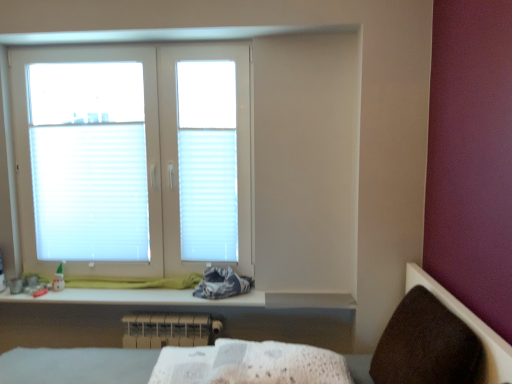
This screenshot has height=384, width=512. What are the coordinates of `white textured fabric at lower center` in the screenshot? It's located at (250, 364).

What do you see at coordinates (90, 192) in the screenshot?
I see `white pleated blind at upper left, acting as the 1th blind starting from the left` at bounding box center [90, 192].

Image resolution: width=512 pixels, height=384 pixels. I want to click on white glossy changing table at lower center, so click(x=194, y=300).

Describe the element at coordinates (426, 345) in the screenshot. I see `brown fabric armchair at lower right` at that location.

Where is `white textured fabric at lower center`? The height and width of the screenshot is (384, 512). white textured fabric at lower center is located at coordinates (250, 364).

From the image's perspective, between white plastic radiator at lower center and brown fabric armchair at lower right, who is located below?

white plastic radiator at lower center, from the image's perspective.

Based on their sizes in the image, would you say white plastic radiator at lower center is bigger or smaller than brown fabric armchair at lower right?

white plastic radiator at lower center is smaller than brown fabric armchair at lower right.

Is brown fabric armchair at lower right completely or partially inside white plastic radiator at lower center?

That's incorrect, brown fabric armchair at lower right is not inside white plastic radiator at lower center.

Based on the photo, from their relative heights in the image, would you say white pleated blind at upper left, which is the 2th blind in right-to-left order, is taller or shorter than white pleated blind at center, which appears as the second blind when viewed from the left?

Clearly, white pleated blind at upper left, which is the 2th blind in right-to-left order, is taller compared to white pleated blind at center, which appears as the second blind when viewed from the left.

How different are the orientations of white pleated blind at upper left, acting as the 1th blind starting from the left, and white pleated blind at center, which is the first blind from right to left, in degrees?

3.19e-05 degrees.

Considering the sizes of white pleated blind at upper left, which is the 2th blind in right-to-left order, and white pleated blind at center, which is the first blind from right to left, in the image, is white pleated blind at upper left, which is the 2th blind in right-to-left order, bigger or smaller than white pleated blind at center, which is the first blind from right to left,?

In the image, white pleated blind at upper left, which is the 2th blind in right-to-left order, appears to be larger than white pleated blind at center, which is the first blind from right to left.

Considering the relative positions of white pleated blind at upper left, which is the 2th blind in right-to-left order, and white pleated blind at center, which is the first blind from right to left, in the image provided, is white pleated blind at upper left, which is the 2th blind in right-to-left order, behind white pleated blind at center, which is the first blind from right to left,?

Yes, the depth of white pleated blind at upper left, which is the 2th blind in right-to-left order, is greater than that of white pleated blind at center, which is the first blind from right to left.

Considering the relative positions of brown fabric armchair at lower right and white pleated blind at center, which appears as the second blind when viewed from the left, in the image provided, is brown fabric armchair at lower right to the left of white pleated blind at center, which appears as the second blind when viewed from the left, from the viewer's perspective?

Incorrect, brown fabric armchair at lower right is not on the left side of white pleated blind at center, which appears as the second blind when viewed from the left.

Is brown fabric armchair at lower right aimed at white pleated blind at center, which appears as the second blind when viewed from the left?

No, brown fabric armchair at lower right does not turn towards white pleated blind at center, which appears as the second blind when viewed from the left.

Considering the relative sizes of brown fabric armchair at lower right and white pleated blind at center, which appears as the second blind when viewed from the left, in the image provided, is brown fabric armchair at lower right shorter than white pleated blind at center, which appears as the second blind when viewed from the left,?

Yes, brown fabric armchair at lower right is shorter than white pleated blind at center, which appears as the second blind when viewed from the left.

Is brown fabric armchair at lower right completely or partially outside of white pleated blind at center, which is the first blind from right to left?

Yes, brown fabric armchair at lower right is outside of white pleated blind at center, which is the first blind from right to left.

Does white plastic window at upper left lie behind white pleated blind at center, which is the first blind from right to left?

No, white plastic window at upper left is closer to the viewer.

Does white plastic window at upper left have a smaller size compared to white pleated blind at center, which is the first blind from right to left?

Actually, white plastic window at upper left might be larger than white pleated blind at center, which is the first blind from right to left.

From the image's perspective, which one is positioned higher, white plastic window at upper left or white pleated blind at center, which is the first blind from right to left?

white plastic window at upper left appears higher in the image.

Is white plastic window at upper left aimed at white pleated blind at center, which is the first blind from right to left?

Yes, white plastic window at upper left is facing white pleated blind at center, which is the first blind from right to left.

Is white glossy changing table at lower center positioned far away from white textured fabric at lower center?

No, white glossy changing table at lower center is not far from white textured fabric at lower center.

What's the angular difference between white glossy changing table at lower center and white textured fabric at lower center's facing directions?

There is a 86-degree angle between the facing directions of white glossy changing table at lower center and white textured fabric at lower center.

Consider the image. Is white glossy changing table at lower center not within white textured fabric at lower center?

white glossy changing table at lower center is positioned outside white textured fabric at lower center.

Between point (42, 299) and point (351, 379), which one is positioned in front?

The point (351, 379) is closer to the camera.

Is white plastic radiator at lower center positioned with its back to white plastic window at upper left?

No, white plastic radiator at lower center is not facing away from white plastic window at upper left.

Could white plastic window at upper left be considered to be inside white plastic radiator at lower center?

Definitely not — white plastic window at upper left is not inside white plastic radiator at lower center.

From a real-world perspective, which object stands above the other?

white plastic window at upper left, from a real-world perspective.

From the image's perspective, is white pleated blind at center, which appears as the second blind when viewed from the left, above or below white plastic radiator at lower center?

Clearly, from the image's perspective, white pleated blind at center, which appears as the second blind when viewed from the left, is above white plastic radiator at lower center.

Consider the image. Who is smaller, white pleated blind at center, which is the first blind from right to left, or white plastic radiator at lower center?

white pleated blind at center, which is the first blind from right to left, is smaller.

Consider the image. How different are the orientations of white pleated blind at center, which is the first blind from right to left, and white plastic radiator at lower center in degrees?

They differ by 4.6e-06 degrees in their facing directions.

Between white pleated blind at center, which is the first blind from right to left, and white plastic radiator at lower center, which one is positioned behind?

white pleated blind at center, which is the first blind from right to left, is further away from the camera.

Where is `armchair on the right of white plastic radiator at lower center`? This screenshot has height=384, width=512. armchair on the right of white plastic radiator at lower center is located at coordinates (426, 345).

This screenshot has height=384, width=512. In the image, there is a white pleated blind at upper left, which is the 2th blind in right-to-left order. What are the coordinates of `blind below it (from a real-world perspective)` in the screenshot? It's located at (208, 194).

From the image, which object appears to be nearer to white textured fabric at lower center, white pleated blind at upper left, acting as the 1th blind starting from the left, or white glossy changing table at lower center?

white glossy changing table at lower center is closer to white textured fabric at lower center.

Looking at the image, which one is located closer to white pleated blind at center, which is the first blind from right to left, white plastic window at upper left or white pleated blind at upper left, which is the 2th blind in right-to-left order?

The object closer to white pleated blind at center, which is the first blind from right to left, is white plastic window at upper left.

When comparing their distances from white plastic radiator at lower center, does white textured fabric at lower center or white pleated blind at center, which appears as the second blind when viewed from the left, seem closer?

Among the two, white pleated blind at center, which appears as the second blind when viewed from the left, is located nearer to white plastic radiator at lower center.

Considering their positions, is white glossy changing table at lower center positioned closer to white plastic radiator at lower center than white pleated blind at center, which appears as the second blind when viewed from the left?

white glossy changing table at lower center lies closer to white plastic radiator at lower center than the other object.

Which object lies nearer to the anchor point white pleated blind at center, which is the first blind from right to left, white textured fabric at lower center or white plastic window at upper left?

The object closer to white pleated blind at center, which is the first blind from right to left, is white plastic window at upper left.

Looking at the image, which one is located closer to white pleated blind at center, which is the first blind from right to left, white pleated blind at upper left, which is the 2th blind in right-to-left order, or white textured fabric at lower center?

white pleated blind at upper left, which is the 2th blind in right-to-left order, is positioned closer to the anchor white pleated blind at center, which is the first blind from right to left.

Looking at the image, which one is located further to white pleated blind at upper left, acting as the 1th blind starting from the left, white plastic radiator at lower center or white glossy changing table at lower center?

white plastic radiator at lower center.

Considering their positions, is white glossy changing table at lower center positioned closer to white plastic window at upper left than white pleated blind at upper left, which is the 2th blind in right-to-left order?

Based on the image, white pleated blind at upper left, which is the 2th blind in right-to-left order, appears to be nearer to white plastic window at upper left.

The image size is (512, 384). Identify the location of window between white pleated blind at upper left, which is the 2th blind in right-to-left order, and white pleated blind at center, which appears as the second blind when viewed from the left, in the horizontal direction. (135, 158).

The width and height of the screenshot is (512, 384). Find the location of `radiator located between white textured fabric at lower center and white pleated blind at center, which appears as the second blind when viewed from the left, in the depth direction`. radiator located between white textured fabric at lower center and white pleated blind at center, which appears as the second blind when viewed from the left, in the depth direction is located at coordinates coord(168,330).

At what (x,y) coordinates should I click in order to perform the action: click on sheet between brown fabric armchair at lower right and white pleated blind at center, which is the first blind from right to left, in the front-back direction. Please return your answer as a coordinate pair (x, y). Looking at the image, I should click on (250, 364).

Locate an element on the screen. window positioned between white textured fabric at lower center and white pleated blind at center, which is the first blind from right to left, from near to far is located at coordinates (135, 158).